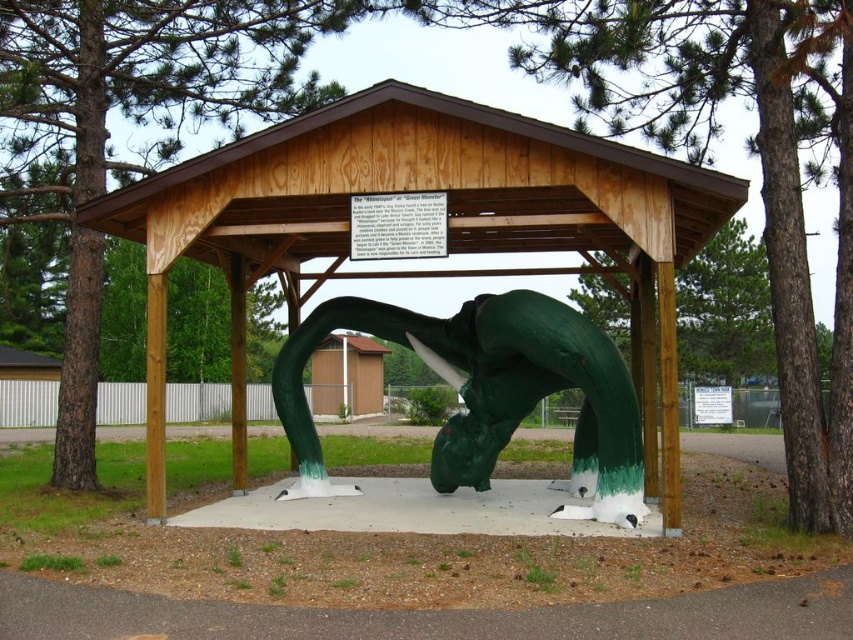
You are planning to install a new lighting system for the green painted wood gazebo at center and the green matte whale at center. Which object requires taller lighting fixtures?

The green matte whale at center requires taller lighting fixtures because it is taller than the green painted wood gazebo at center.

You are a visitor at the park and want to take a photo of the green matte whale at center. Since the green painted wood gazebo at center is blocking your view, can you move the gazebo to get a clear shot? Explain why or why not based on their positions.

The green painted wood gazebo at center is positioned over the green matte whale at center, meaning the gazebo is directly above the whale. Moving the gazebo would require lifting it, which is not feasible for a visitor. Therefore, you cannot move the gazebo to get a clear shot.

You are a visitor standing at the entrance of the pavilion and see the green matte tree at center and the green matte tree trunk at center. Which one is closer to you?

The green matte tree at center is closer to you because it is in front of the green matte tree trunk at center.